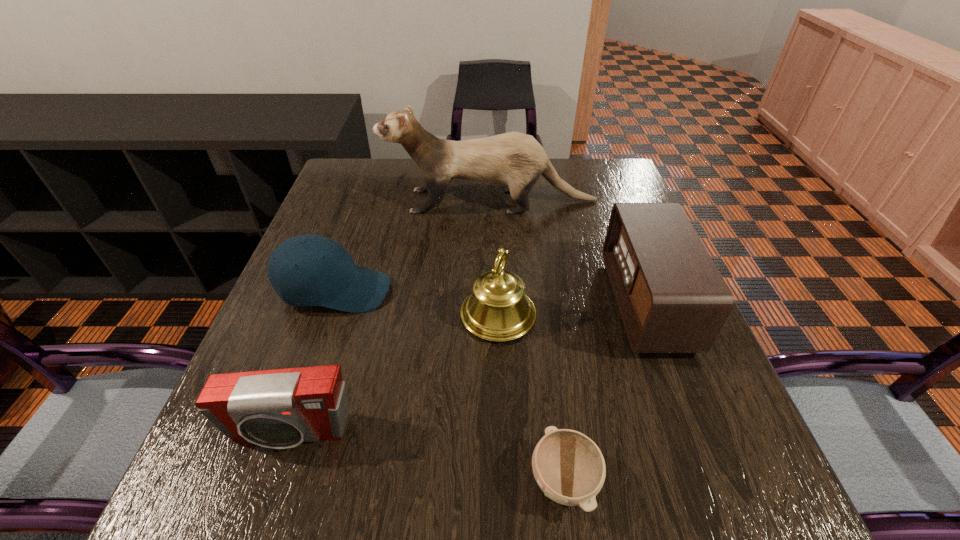
Image resolution: width=960 pixels, height=540 pixels. In order to click on the farthest object in this screenshot , I will do pos(516,160).

This screenshot has height=540, width=960. Identify the location of ferret. (516, 160).

At what (x,y) coordinates should I click in order to perform the action: click on bell. Please return your answer as a coordinate pair (x, y). Looking at the image, I should click on (498, 310).

Locate an element on the screen. The image size is (960, 540). radio receiver is located at coordinates (672, 298).

The width and height of the screenshot is (960, 540). Identify the location of baseball cap. (307, 270).

Where is `camera`? Image resolution: width=960 pixels, height=540 pixels. camera is located at coordinates (281, 408).

In order to click on the shortest object in this screenshot , I will do `click(568, 466)`.

Where is `vacant space located 0.170m on the face of the tallest object`? vacant space located 0.170m on the face of the tallest object is located at coordinates (324, 201).

Identify the location of vacant space located 0.150m on the face of the tallest object. The image size is (960, 540). (330, 201).

Locate an element on the screen. free spot located on the face of the tallest object is located at coordinates (367, 201).